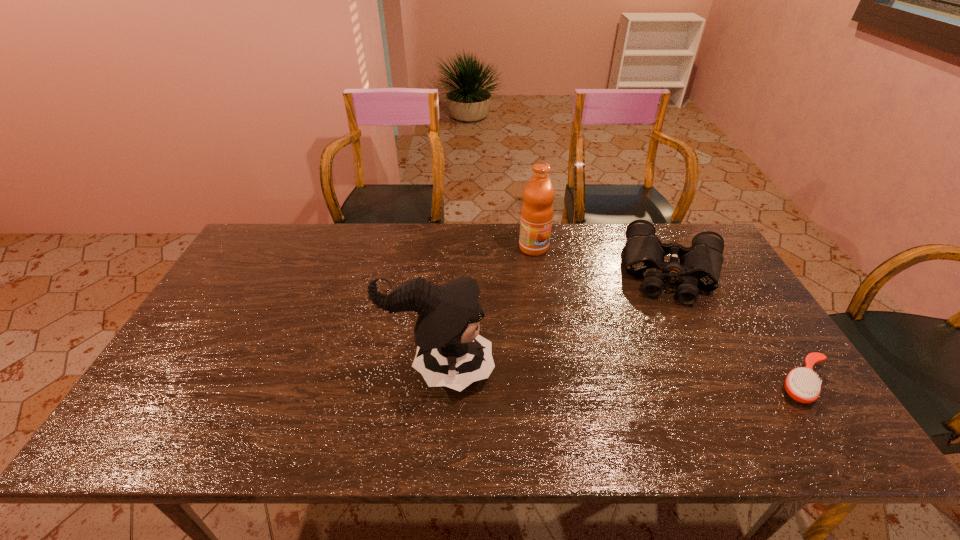
Find the location of a particular element. vacant space on the desktop that is between the leftmost object and the shortest object and is positioned through the eyepieces of the third tallest object is located at coordinates (673, 378).

I want to click on vacant spot on the desktop that is between the doll and the shortest object and is positioned on the label side of the fruit juice, so click(674, 378).